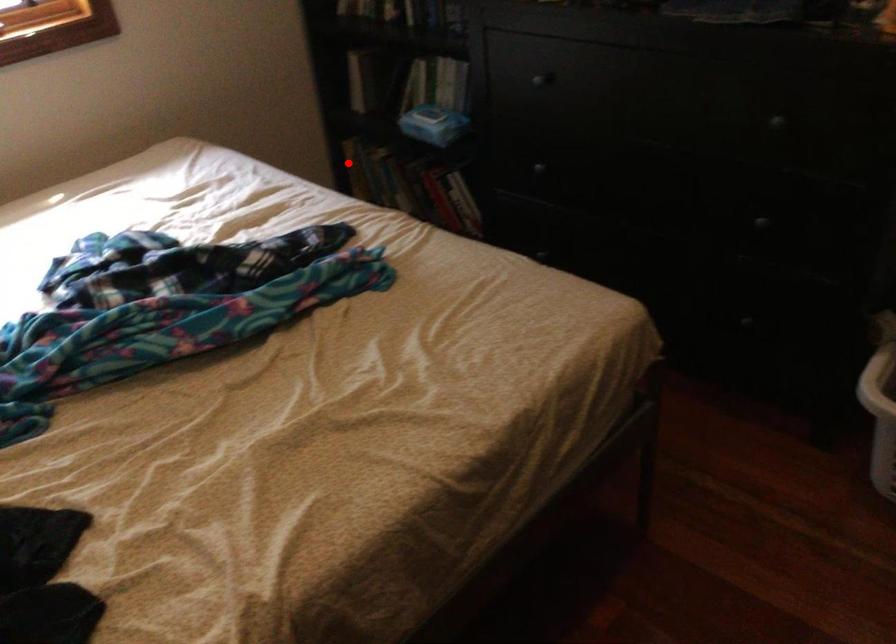
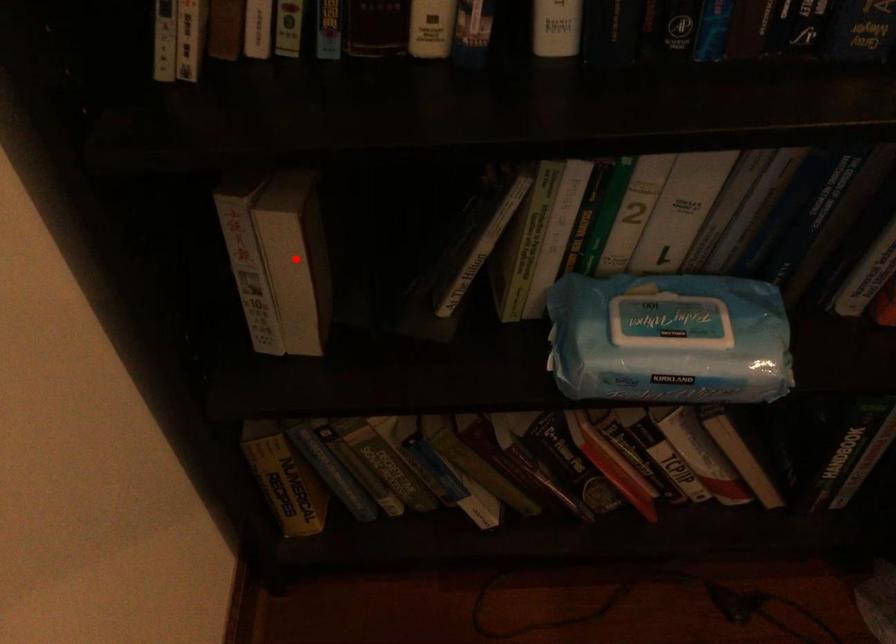
I am providing you with two images of the same scene from different viewpoints. A red point is marked on the first image and another point is marked on the second image. Do the highlighted points in image1 and image2 indicate the same real-world spot?

No